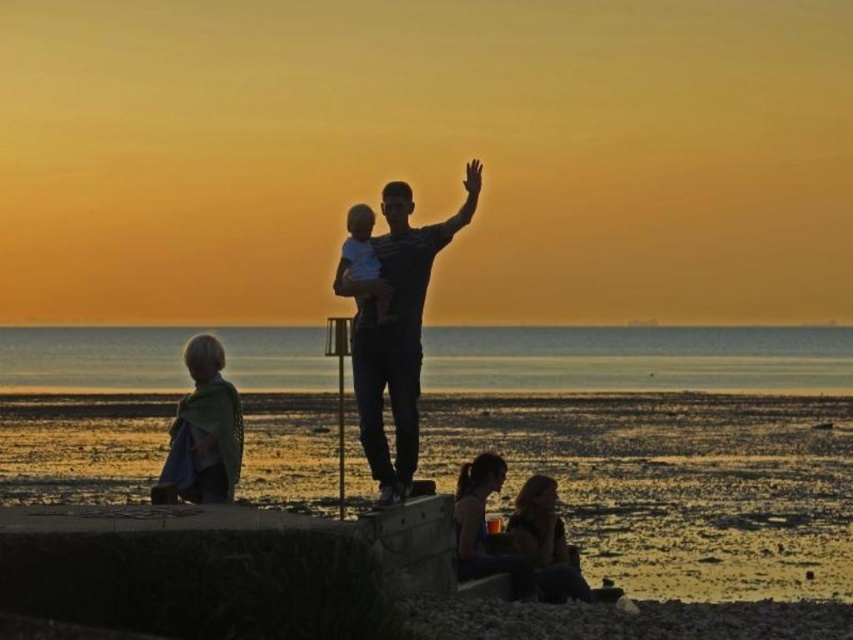
You are a photographer trying to capture the sunset scene. You notice the matte black shirt at center and the blonde hair fabric child at lower left. Which object is positioned higher in the image?

The matte black shirt at center is located above the blonde hair fabric child at lower left, so it is positioned higher in the image.

You are a photographer trying to capture the sunset scene. You notice the matte black shirt at center and the smooth white baby at center. Which object is positioned lower in the image?

The matte black shirt at center is below the smooth white baby at center, so the matte black shirt at center is positioned lower in the image.

You are a photographer trying to capture the sunset scene. You notice two children in the frame. One is a blonde hair fabric child at lower left and the other is a smooth white baby at center. Which child is positioned lower in the image?

The blonde hair fabric child at lower left is positioned lower in the image than the smooth white baby at center.